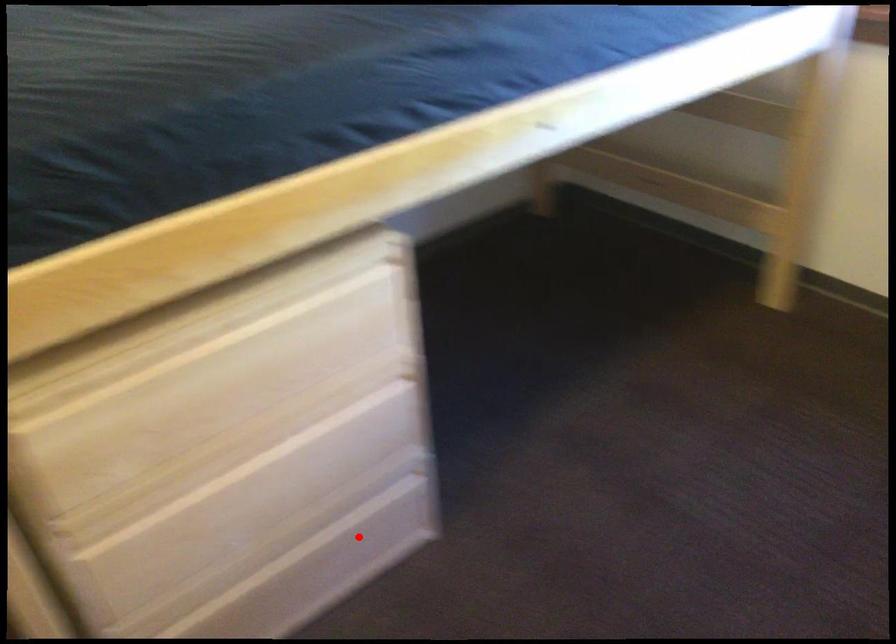
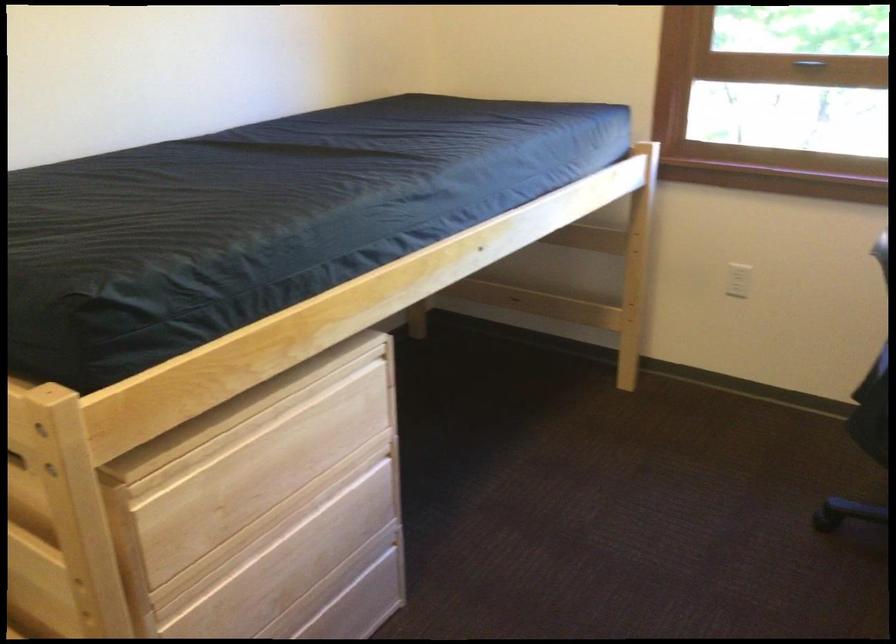
Where in the second image is the point corresponding to the highlighted location from the first image?

(354, 611)